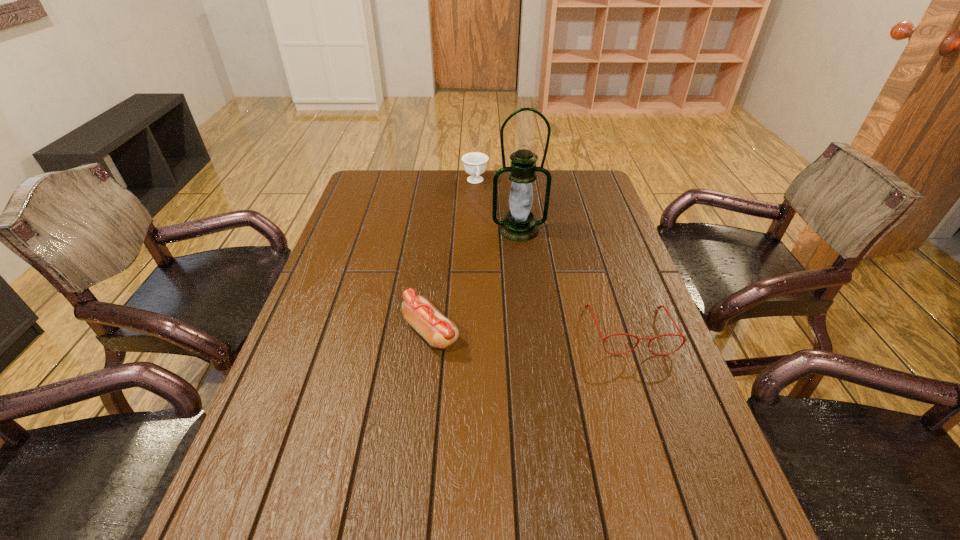
I want to click on vacant space on the desktop that is between the sausage and the spectacles and is positioned on the side where the lantern emits light, so click(533, 331).

Locate an element on the screen. The height and width of the screenshot is (540, 960). vacant space on the desktop that is between the sausage and the rightmost object and is positioned on the side of the teacup with the handle is located at coordinates (527, 331).